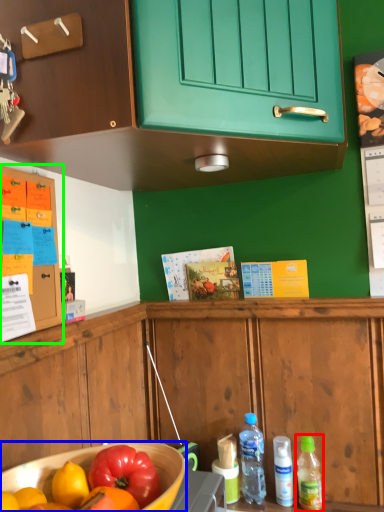
Question: Which is nearer to the bottle (highlighted by a red box)? bowl (highlighted by a blue box) or cabinetry (highlighted by a green box).

Choices:
 (A) bowl
 (B) cabinetry

Answer: (A)